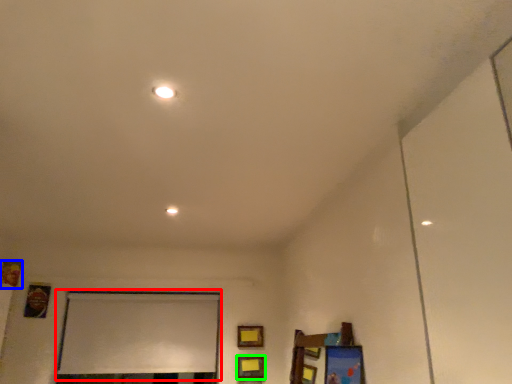
Question: Which object is positioned farthest from window screen (highlighted by a red box)? Select from picture frame (highlighted by a blue box) and picture frame (highlighted by a green box).

Choices:
 (A) picture frame
 (B) picture frame

Answer: (A)